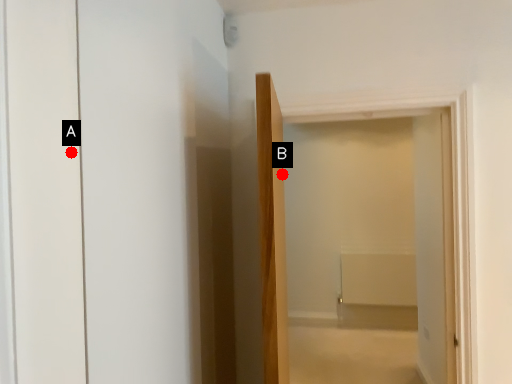
Question: Two points are circled on the image, labeled by A and B beside each circle. Among these points, which one is nearest to the camera?

Choices:
 (A) A is closer
 (B) B is closer

Answer: (A)